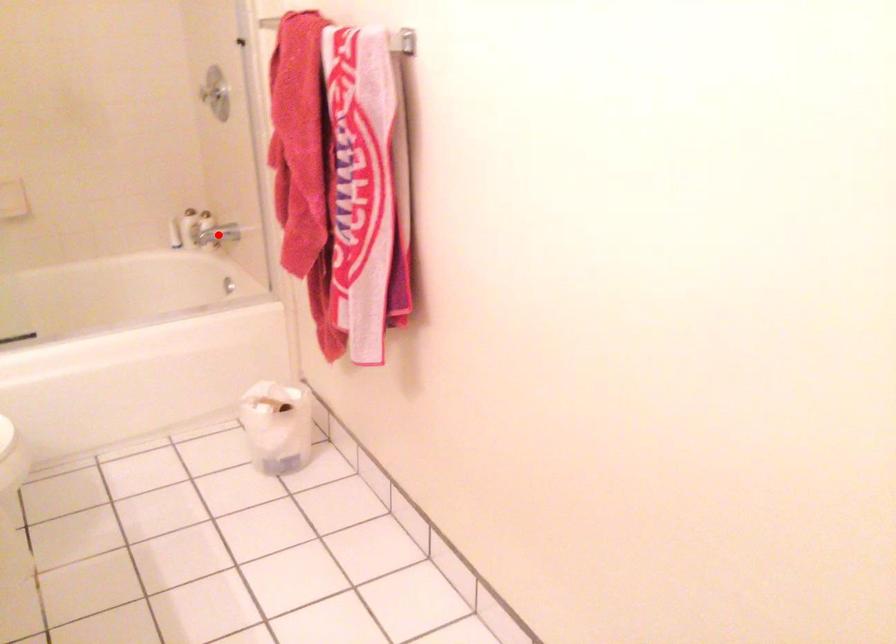
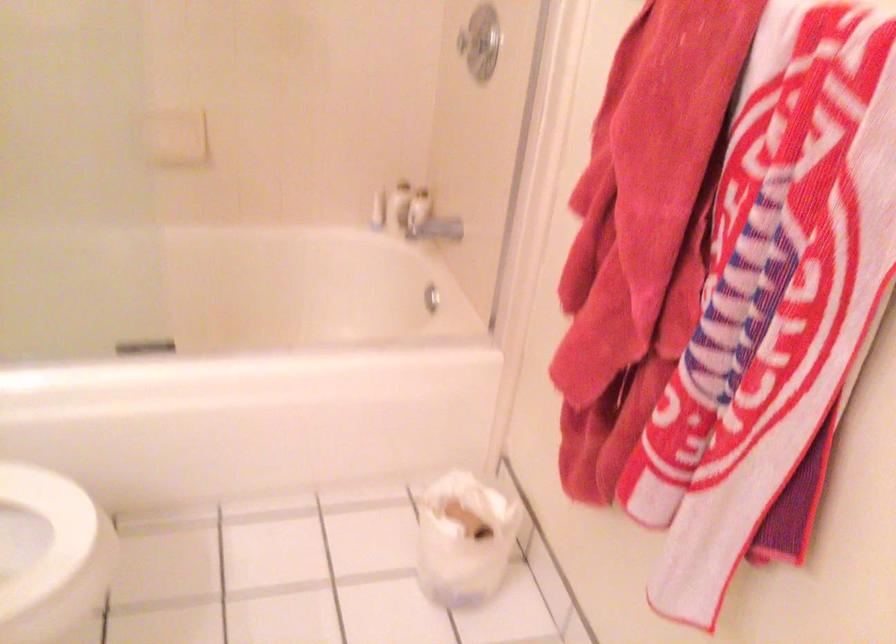
Question: A red point is marked in image1. In image2, is the corresponding 3D point closer to the camera or farther? Reply with the corresponding letter.

Choices:
 (A) The corresponding 3D point is closer.
 (B) The corresponding 3D point is farther.

Answer: (A)